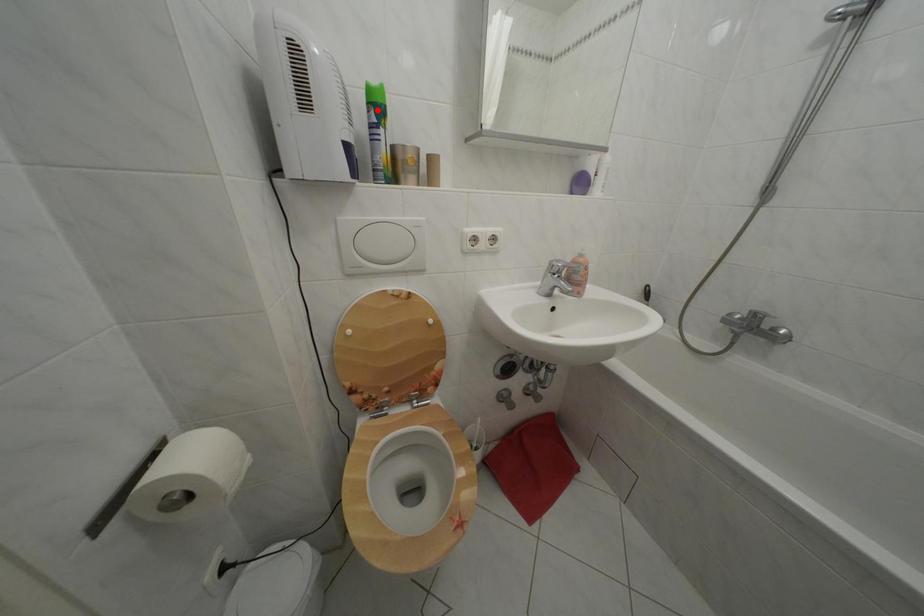
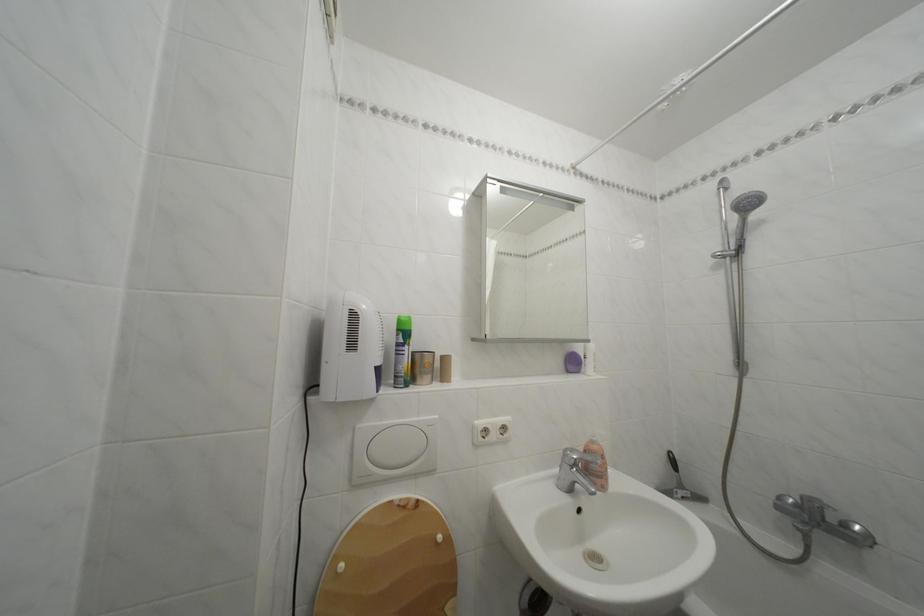
In the second image, find the point that corresponds to the highlighted location in the first image.

(407, 336)